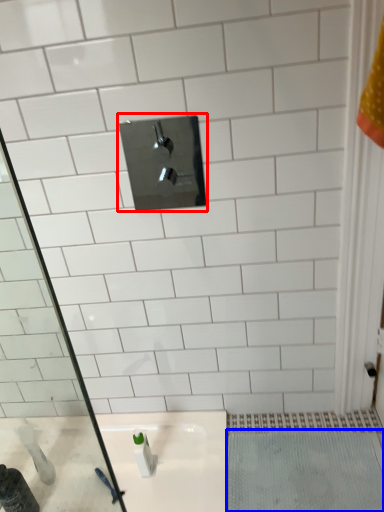
Question: Which of the following is the closest to the observer, tap (highlighted by a red box) or bath mat (highlighted by a blue box)?

Choices:
 (A) tap
 (B) bath mat

Answer: (A)